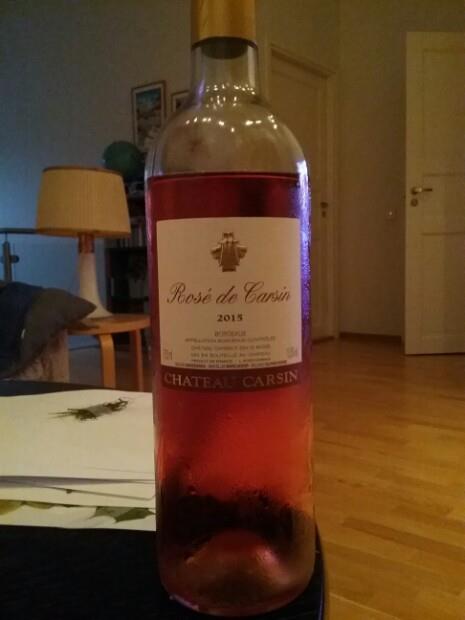
Where is `metal, lever door handle`? The height and width of the screenshot is (620, 465). metal, lever door handle is located at coordinates (413, 187), (429, 188).